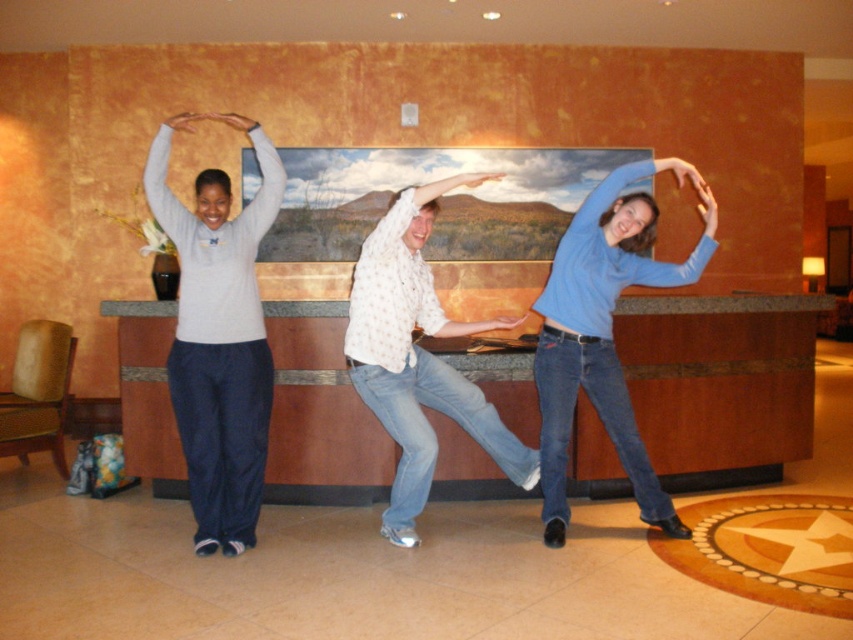
Question: Can you confirm if matte gray sweater at left is smaller than white dotted shirt at center?

Choices:
 (A) no
 (B) yes

Answer: (B)

Question: Which is farther from the matte gray sweater at left?

Choices:
 (A) white dotted shirt at center
 (B) blue denim jeans at center

Answer: (B)

Question: Observing the image, what is the correct spatial positioning of blue denim jeans at center in reference to white dotted shirt at center?

Choices:
 (A) left
 (B) right

Answer: (B)

Question: Does matte gray sweater at left appear over white dotted shirt at center?

Choices:
 (A) no
 (B) yes

Answer: (B)

Question: Which object appears closest to the camera in this image?

Choices:
 (A) white dotted shirt at center
 (B) matte gray sweater at left
 (C) blue denim jeans at center

Answer: (A)

Question: Which point is closer to the camera taking this photo?

Choices:
 (A) (592, 376)
 (B) (393, 308)
 (C) (227, 518)

Answer: (B)